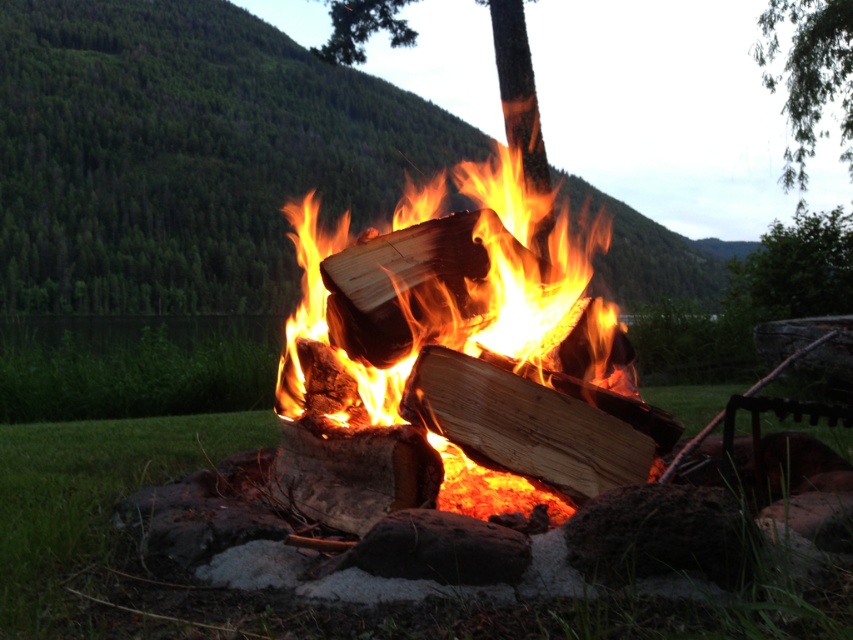
Question: Among these points, which one is farthest from the camera?

Choices:
 (A) (834, 72)
 (B) (369, 352)
 (C) (608, 467)

Answer: (A)

Question: Can you confirm if charred wood fire at center is thinner than natural wood at center?

Choices:
 (A) yes
 (B) no

Answer: (B)

Question: Which object appears closest to the camera in this image?

Choices:
 (A) green leafy tree at upper right
 (B) natural wood at center

Answer: (B)

Question: Is the position of charred wood fire at center less distant than that of green leafy tree at upper right?

Choices:
 (A) yes
 (B) no

Answer: (A)

Question: Which object is closer to the camera taking this photo?

Choices:
 (A) natural wood at center
 (B) green leafy tree at upper right
 (C) charred wood fire at center

Answer: (A)

Question: Does charred wood fire at center have a greater width compared to natural wood at center?

Choices:
 (A) no
 (B) yes

Answer: (B)